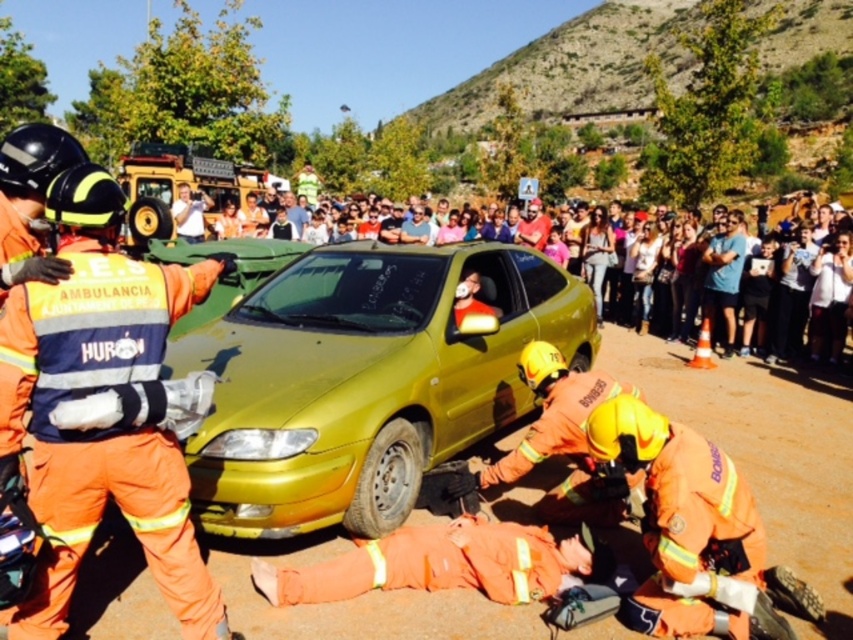
Question: Can you confirm if orange fabric fireman at left is positioned below multicolored casual clothing at upper center?

Choices:
 (A) no
 (B) yes

Answer: (B)

Question: Does orange fabric fireman at left have a larger size compared to multicolored casual clothing at upper center?

Choices:
 (A) no
 (B) yes

Answer: (A)

Question: Which point is farther from the camera taking this photo?

Choices:
 (A) (194, 596)
 (B) (231, 298)

Answer: (B)

Question: Which object appears farthest from the camera in this image?

Choices:
 (A) orange fabric fireman at left
 (B) multicolored casual clothing at upper center

Answer: (B)

Question: From the image, what is the correct spatial relationship of gold matte car at center in relation to multicolored casual clothing at upper center?

Choices:
 (A) below
 (B) above

Answer: (A)

Question: Which point appears closest to the camera in this image?

Choices:
 (A) pos(567,332)
 (B) pos(294,252)
 (C) pos(93,461)

Answer: (C)